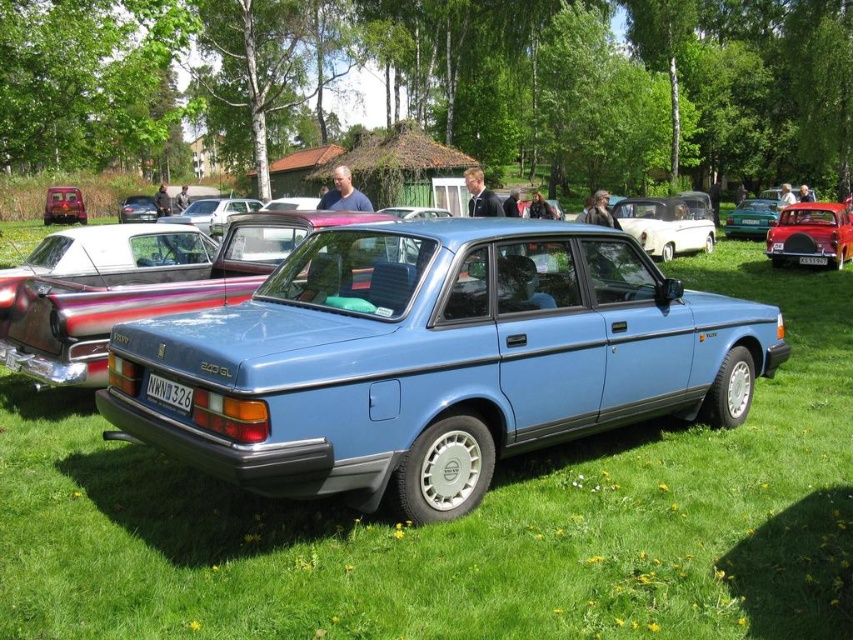
Question: Is the position of shiny red car at right less distant than that of white plastic license plate at center?

Choices:
 (A) no
 (B) yes

Answer: (A)

Question: Which object is closer to the camera taking this photo?

Choices:
 (A) white glossy sedan at center
 (B) metallic teal sedan at center
 (C) black plastic license plate at center

Answer: (C)

Question: Does shiny red car at right come behind white plastic license plate at center?

Choices:
 (A) no
 (B) yes

Answer: (B)

Question: Which point is farther to the camera?

Choices:
 (A) black plastic license plate at center
 (B) metallic red car at left

Answer: (B)

Question: Which object is closer to the camera taking this photo?

Choices:
 (A) white plastic license plate at center
 (B) metallic teal sedan at center
 (C) shiny red car at right
 (D) white glossy sedan at center

Answer: (A)

Question: From the image, what is the correct spatial relationship of metallic red car at left in relation to white plastic license plate at center?

Choices:
 (A) left
 (B) right

Answer: (A)